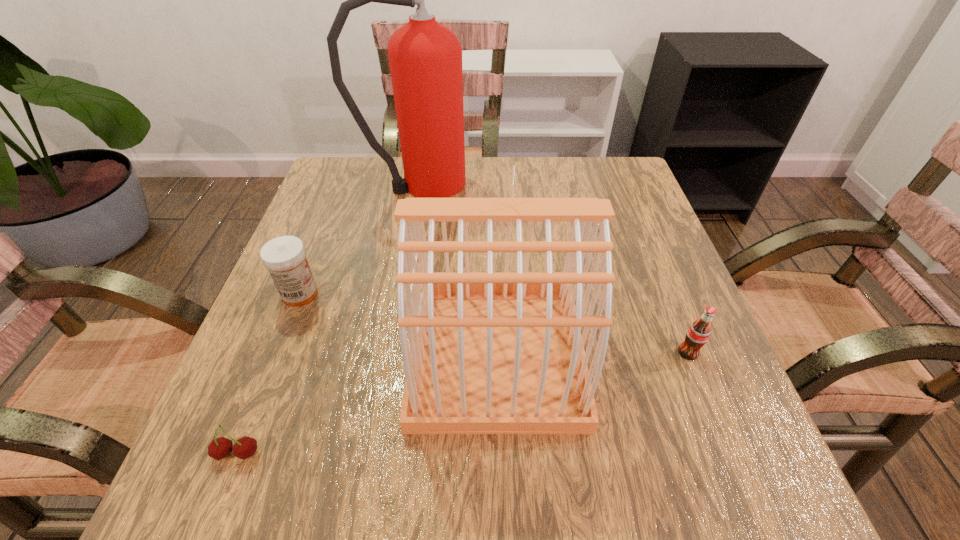
I want to click on free location located 0.150m with an open door on the fourth shortest object, so click(324, 354).

Where is `vacant space located 0.200m on the back of the medicine`? vacant space located 0.200m on the back of the medicine is located at coordinates [329, 219].

At what (x,y) coordinates should I click in order to perform the action: click on free region located on the back of the soda. Please return your answer as a coordinate pair (x, y). Looking at the image, I should click on click(638, 229).

This screenshot has width=960, height=540. I want to click on vacant space positioned 0.050m on the surface of the cherry, so click(218, 502).

Where is `object located in the far edge section of the desktop`? The image size is (960, 540). object located in the far edge section of the desktop is located at coordinates (425, 57).

Find the location of `object that is at the near edge`. object that is at the near edge is located at coordinates (245, 447).

Find the location of a particular element. This screenshot has width=960, height=540. fire extinguisher that is at the left edge is located at coordinates 425,57.

Locate an element on the screen. The width and height of the screenshot is (960, 540). medicine at the left edge is located at coordinates (285, 257).

Locate an element on the screen. The height and width of the screenshot is (540, 960). cherry that is at the left edge is located at coordinates (245, 447).

The width and height of the screenshot is (960, 540). I want to click on object that is at the right edge, so click(698, 333).